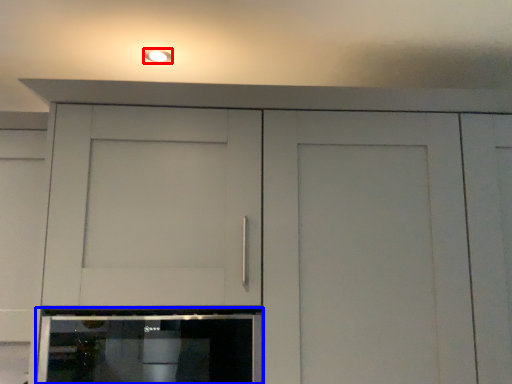
Question: Which point is closer to the camera, lighting (highlighted by a red box) or home appliance (highlighted by a blue box)?

Choices:
 (A) lighting
 (B) home appliance

Answer: (B)